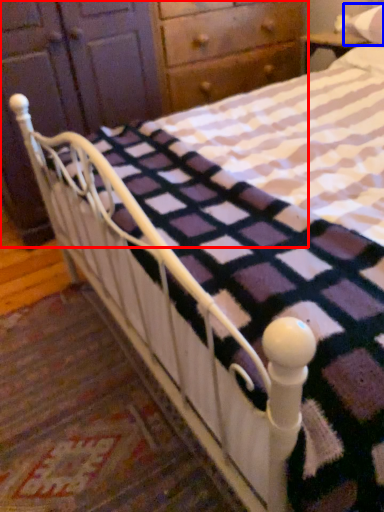
Question: Which object is closer to the camera taking this photo, dresser (highlighted by a red box) or pillow (highlighted by a blue box)?

Choices:
 (A) dresser
 (B) pillow

Answer: (A)